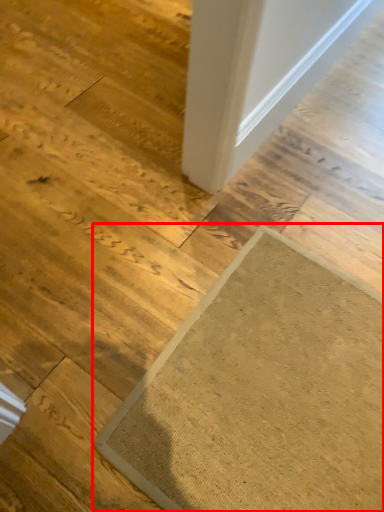
Question: From the image's perspective, considering the relative positions of mat (annotated by the red box) and door in the image provided, where is mat (annotated by the red box) located with respect to the staircase?

Choices:
 (A) below
 (B) above

Answer: (A)